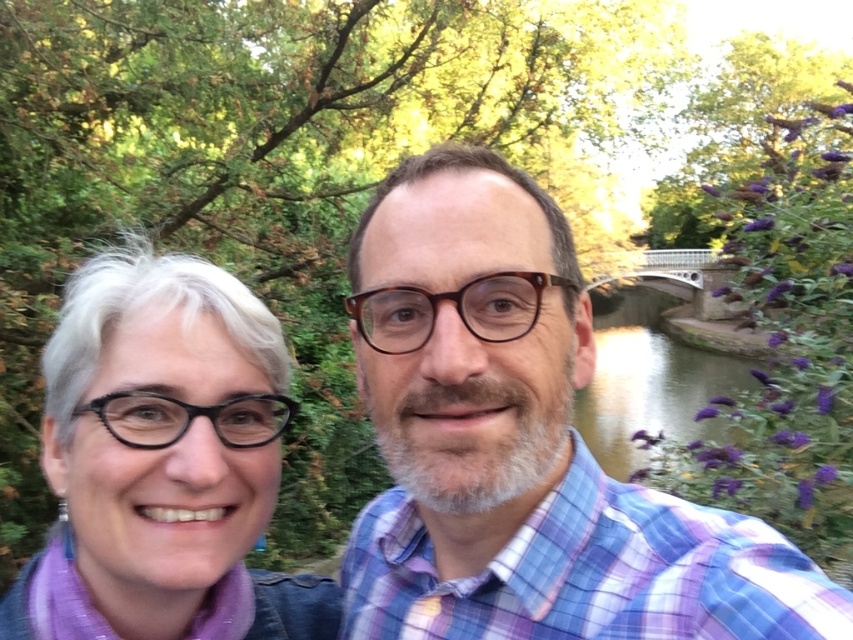
Question: Observing the image, what is the correct spatial positioning of blue plaid shirt at center in reference to matte black glasses at left?

Choices:
 (A) right
 (B) left

Answer: (A)

Question: Which point is closer to the camera?

Choices:
 (A) (114, 285)
 (B) (515, 576)

Answer: (B)

Question: Which object is farther from the camera taking this photo?

Choices:
 (A) matte black glasses at left
 (B) blue plaid shirt at center

Answer: (A)

Question: Is blue plaid shirt at center wider than matte black glasses at left?

Choices:
 (A) yes
 (B) no

Answer: (A)

Question: Among these objects, which one is farthest from the camera?

Choices:
 (A) blue plaid shirt at center
 (B) matte black glasses at left

Answer: (B)

Question: Is blue plaid shirt at center positioned before matte black glasses at left?

Choices:
 (A) no
 (B) yes

Answer: (B)